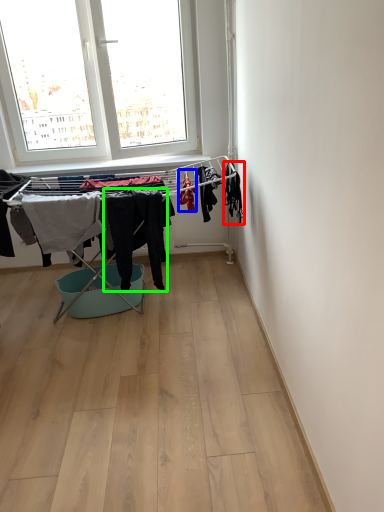
Question: Considering the real-world distances, which object is farthest from clothing (highlighted by a red box)? clothing (highlighted by a blue box) or clothing (highlighted by a green box)?

Choices:
 (A) clothing
 (B) clothing

Answer: (B)